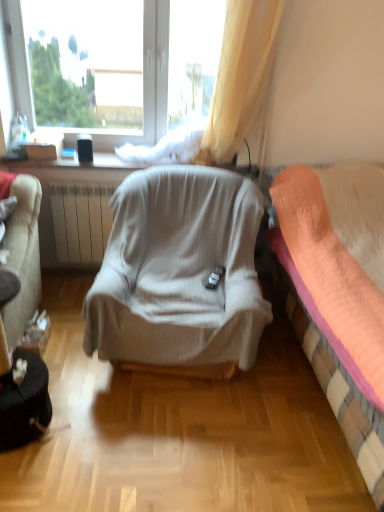
The height and width of the screenshot is (512, 384). Describe the element at coordinates (339, 292) in the screenshot. I see `orange fabric bed at right` at that location.

Locate an element on the screen. transparent plastic window at upper center is located at coordinates (155, 70).

Locate an element on the screen. The width and height of the screenshot is (384, 512). orange fabric bed at right is located at coordinates (339, 292).

Between transparent plastic window at upper center and light gray fabric chair at center, which one has less height?

light gray fabric chair at center.

Consider the image. Are transparent plastic window at upper center and light gray fabric chair at center located far from each other?

transparent plastic window at upper center is far away from light gray fabric chair at center.

This screenshot has height=512, width=384. I want to click on chair below the transparent plastic window at upper center (from the image's perspective), so click(x=179, y=273).

Is point (146, 141) farther from camera compared to point (363, 329)?

Yes, point (146, 141) is behind point (363, 329).

Is transparent plastic window at upper center thinner than orange fabric bed at right?

Yes.

Would you say transparent plastic window at upper center is to the left or to the right of orange fabric bed at right in the picture?

transparent plastic window at upper center is to the left of orange fabric bed at right.

Which is correct: transparent plastic window at upper center is inside orange fabric bed at right, or outside of it?

transparent plastic window at upper center is not enclosed by orange fabric bed at right.

Considering the sizes of objects light gray fabric chair at center and orange fabric bed at right in the image provided, who is shorter, light gray fabric chair at center or orange fabric bed at right?

light gray fabric chair at center.

Which is correct: light gray fabric chair at center is inside orange fabric bed at right, or outside of it?

light gray fabric chair at center exists outside the volume of orange fabric bed at right.

Considering the relative sizes of light gray fabric chair at center and orange fabric bed at right in the image provided, is light gray fabric chair at center thinner than orange fabric bed at right?

Yes, light gray fabric chair at center is thinner than orange fabric bed at right.

Is light gray fabric chair at center smaller than orange fabric bed at right?

Yes.

Between orange fabric bed at right and light gray fabric chair at center, which one has larger width?

With larger width is orange fabric bed at right.

Locate an element on the screen. This screenshot has height=512, width=384. chair lying above the orange fabric bed at right (from the image's perspective) is located at coordinates (179, 273).

Does point (339, 262) come in front of point (125, 284)?

Yes, it is in front of point (125, 284).

From the image's perspective, is orange fabric bed at right beneath light gray fabric chair at center?

Yes, from the image's perspective, orange fabric bed at right is beneath light gray fabric chair at center.

Which is more to the left, orange fabric bed at right or transparent plastic window at upper center?

Positioned to the left is transparent plastic window at upper center.

Considering the sizes of orange fabric bed at right and transparent plastic window at upper center in the image, is orange fabric bed at right taller or shorter than transparent plastic window at upper center?

In the image, orange fabric bed at right appears to be taller than transparent plastic window at upper center.

Between point (324, 337) and point (166, 124), which one is positioned in front?

The point (324, 337) is more forward.

Find the location of `bed located below the transparent plastic window at upper center (from the image's perspective)`. bed located below the transparent plastic window at upper center (from the image's perspective) is located at coordinates (339, 292).

From a real-world perspective, which object rests below the other?

From a 3D spatial view, light gray fabric chair at center is below.

Consider the image. From the image's perspective, would you say light gray fabric chair at center is positioned over transparent plastic window at upper center?

No, from the image's perspective, light gray fabric chair at center is not on top of transparent plastic window at upper center.

In the image, is light gray fabric chair at center positioned in front of or behind transparent plastic window at upper center?

Visually, light gray fabric chair at center is located in front of transparent plastic window at upper center.

You are a GUI agent. You are given a task and a screenshot of the screen. Output one action in this format:
    pyautogui.click(x=<x>, y=<y>)
    Task: Click on the window on the left of the light gray fabric chair at center
    The height and width of the screenshot is (512, 384).
    Given the screenshot: What is the action you would take?
    pyautogui.click(x=155, y=70)

Find the location of `chair below the transparent plastic window at upper center (from the image's perspective)`. chair below the transparent plastic window at upper center (from the image's perspective) is located at coordinates (179, 273).

Find the location of a particular element. bed below the transparent plastic window at upper center (from a real-world perspective) is located at coordinates (339, 292).

Looking at the image, which one is located closer to orange fabric bed at right, transparent plastic window at upper center or light gray fabric chair at center?

light gray fabric chair at center.

From the image, which object appears to be farther from orange fabric bed at right, light gray fabric chair at center or transparent plastic window at upper center?

transparent plastic window at upper center is positioned further to the anchor orange fabric bed at right.

Based on their spatial positions, is transparent plastic window at upper center or orange fabric bed at right closer to light gray fabric chair at center?

orange fabric bed at right is positioned closer to the anchor light gray fabric chair at center.

Based on their spatial positions, is orange fabric bed at right or transparent plastic window at upper center closer to light gray fabric chair at center?

orange fabric bed at right is closer to light gray fabric chair at center.

Consider the image. When comparing their distances from transparent plastic window at upper center, does light gray fabric chair at center or orange fabric bed at right seem closer?

light gray fabric chair at center.

Which object lies further to the anchor point transparent plastic window at upper center, orange fabric bed at right or light gray fabric chair at center?

orange fabric bed at right is positioned further to the anchor transparent plastic window at upper center.

At what (x,y) coordinates should I click in order to perform the action: click on chair between orange fabric bed at right and transparent plastic window at upper center in the front-back direction. Please return your answer as a coordinate pair (x, y). The image size is (384, 512). Looking at the image, I should click on click(x=179, y=273).